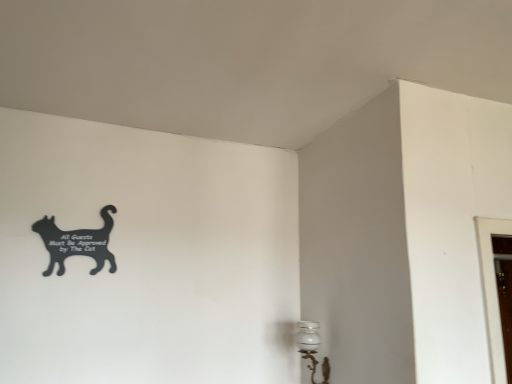
Question: Is point (77, 248) positioned closer to the camera than point (300, 347)?

Choices:
 (A) farther
 (B) closer

Answer: (B)

Question: Is black matte sign at upper left taller or shorter than white glossy lamp at lower right?

Choices:
 (A) tall
 (B) short

Answer: (B)

Question: From a real-world perspective, is black matte sign at upper left above or below white glossy lamp at lower right?

Choices:
 (A) below
 (B) above

Answer: (B)

Question: From the image's perspective, is white glossy lamp at lower right above or below black matte sign at upper left?

Choices:
 (A) below
 (B) above

Answer: (A)

Question: Is white glossy lamp at lower right bigger or smaller than black matte sign at upper left?

Choices:
 (A) small
 (B) big

Answer: (B)

Question: Is white glossy lamp at lower right taller or shorter than black matte sign at upper left?

Choices:
 (A) short
 (B) tall

Answer: (B)

Question: Considering the positions of point (311, 334) and point (55, 246), is point (311, 334) closer or farther from the camera than point (55, 246)?

Choices:
 (A) closer
 (B) farther

Answer: (A)